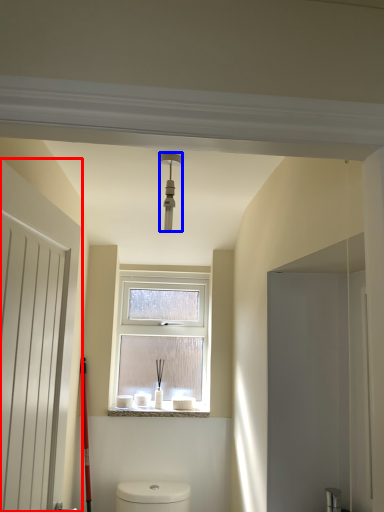
Question: Which object appears closest to the camera in this image, door (highlighted by a red box) or light fixture (highlighted by a blue box)?

Choices:
 (A) door
 (B) light fixture

Answer: (A)